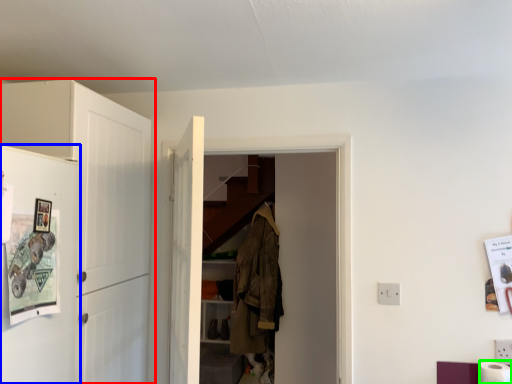
Question: Considering the real-world distances, which object is farthest from cabinetry (highlighted by a red box)? fridge (highlighted by a blue box) or toilet paper (highlighted by a green box)?

Choices:
 (A) fridge
 (B) toilet paper

Answer: (B)